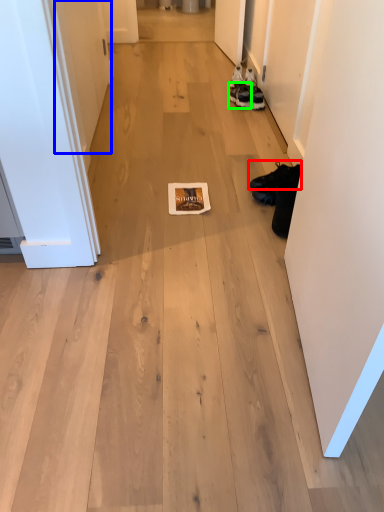
Question: Considering the real-world distances, which object is farthest from footwear (highlighted by a red box)? door (highlighted by a blue box) or footwear (highlighted by a green box)?

Choices:
 (A) door
 (B) footwear

Answer: (A)